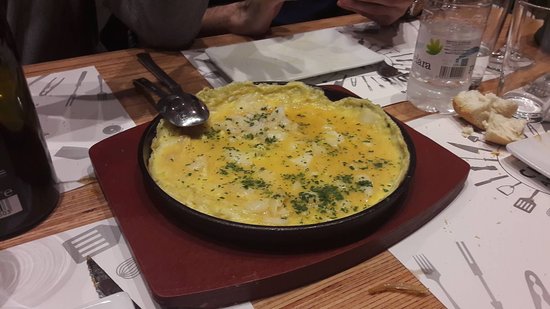
Where is `tray`? This screenshot has height=309, width=550. tray is located at coordinates point(205,273).